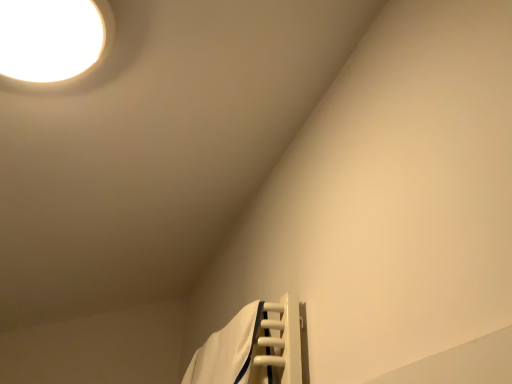
Question: From the image's perspective, is white glossy light fixture at upper left located above white fabric bath towel at lower right?

Choices:
 (A) no
 (B) yes

Answer: (B)

Question: Considering the relative positions of white glossy light fixture at upper left and white fabric bath towel at lower right in the image provided, is white glossy light fixture at upper left to the left of white fabric bath towel at lower right from the viewer's perspective?

Choices:
 (A) no
 (B) yes

Answer: (B)

Question: Is white glossy light fixture at upper left behind white fabric bath towel at lower right?

Choices:
 (A) no
 (B) yes

Answer: (A)

Question: From a real-world perspective, is white glossy light fixture at upper left physically below white fabric bath towel at lower right?

Choices:
 (A) yes
 (B) no

Answer: (B)

Question: Could you tell me if white glossy light fixture at upper left is turned towards white fabric bath towel at lower right?

Choices:
 (A) no
 (B) yes

Answer: (A)

Question: Can you confirm if white glossy light fixture at upper left is wider than white fabric bath towel at lower right?

Choices:
 (A) no
 (B) yes

Answer: (B)

Question: Does white fabric bath towel at lower right have a lesser width compared to white glossy light fixture at upper left?

Choices:
 (A) yes
 (B) no

Answer: (A)

Question: From a real-world perspective, is white fabric bath towel at lower right on white glossy light fixture at upper left?

Choices:
 (A) yes
 (B) no

Answer: (B)

Question: From a real-world perspective, is white fabric bath towel at lower right located beneath white glossy light fixture at upper left?

Choices:
 (A) no
 (B) yes

Answer: (B)

Question: Can you confirm if white fabric bath towel at lower right is shorter than white glossy light fixture at upper left?

Choices:
 (A) yes
 (B) no

Answer: (B)

Question: Can you confirm if white fabric bath towel at lower right is taller than white glossy light fixture at upper left?

Choices:
 (A) no
 (B) yes

Answer: (B)

Question: Does white fabric bath towel at lower right have a greater width compared to white glossy light fixture at upper left?

Choices:
 (A) yes
 (B) no

Answer: (B)

Question: Is white glossy light fixture at upper left inside or outside of white fabric bath towel at lower right?

Choices:
 (A) outside
 (B) inside

Answer: (A)